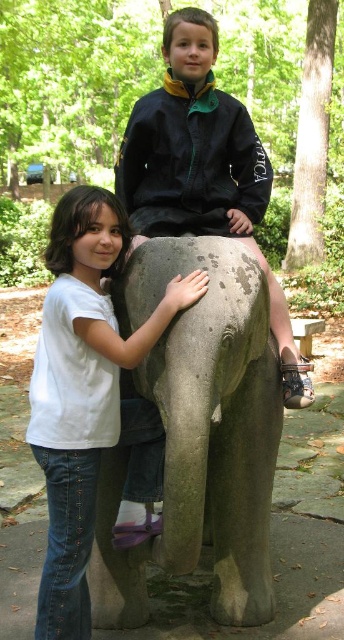
You are a park ranger who needs to determine if a 30 inch wide bench can fit between the white matte shirt at left and the dark blue jacket at upper center. Can it fit?

The distance between the white matte shirt at left and the dark blue jacket at upper center is 31.22 inches, so the 30 inch wide bench can fit between them since it is narrower than the available space.

You are a photographer trying to capture the boy in the scene. The white matte shirt at left and dark blue jacket at upper center are both visible in your frame. Which clothing item appears smaller in the photo?

The white matte shirt at left appears smaller in the photo because it is smaller than the dark blue jacket at upper center.